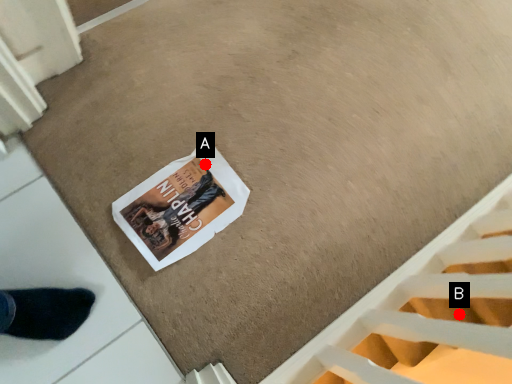
Question: Two points are circled on the image, labeled by A and B beside each circle. Which point appears closest to the camera in this image?

Choices:
 (A) A is closer
 (B) B is closer

Answer: (A)